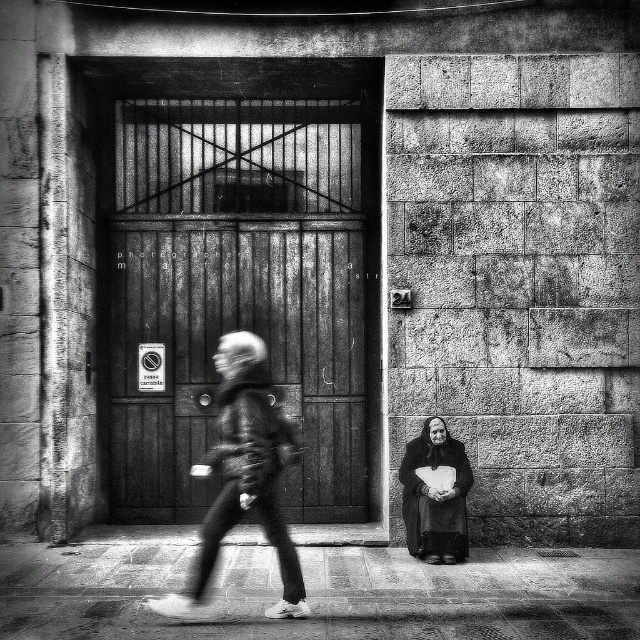
Is point (362, 467) positioned behind point (232, 429)?

Yes.

Which is behind, point (358, 321) or point (252, 502)?

The point (358, 321) is behind.

What are the coordinates of `wooden door at center` in the screenshot? It's located at (214, 346).

Is gray textured jacket at center thinner than dark gray fabric at lower right?

In fact, gray textured jacket at center might be wider than dark gray fabric at lower right.

Can you confirm if gray textured jacket at center is bigger than dark gray fabric at lower right?

Yes, gray textured jacket at center is bigger than dark gray fabric at lower right.

Find the location of a particular element. This screenshot has height=640, width=640. gray textured jacket at center is located at coordinates (244, 476).

Does wooden door at center have a greater height compared to dark gray fabric at lower right?

Correct, wooden door at center is much taller as dark gray fabric at lower right.

Can you confirm if wooden door at center is bigger than dark gray fabric at lower right?

Indeed, wooden door at center has a larger size compared to dark gray fabric at lower right.

The image size is (640, 640). What do you see at coordinates (214, 346) in the screenshot? I see `wooden door at center` at bounding box center [214, 346].

Image resolution: width=640 pixels, height=640 pixels. Identify the location of wooden door at center. (214, 346).